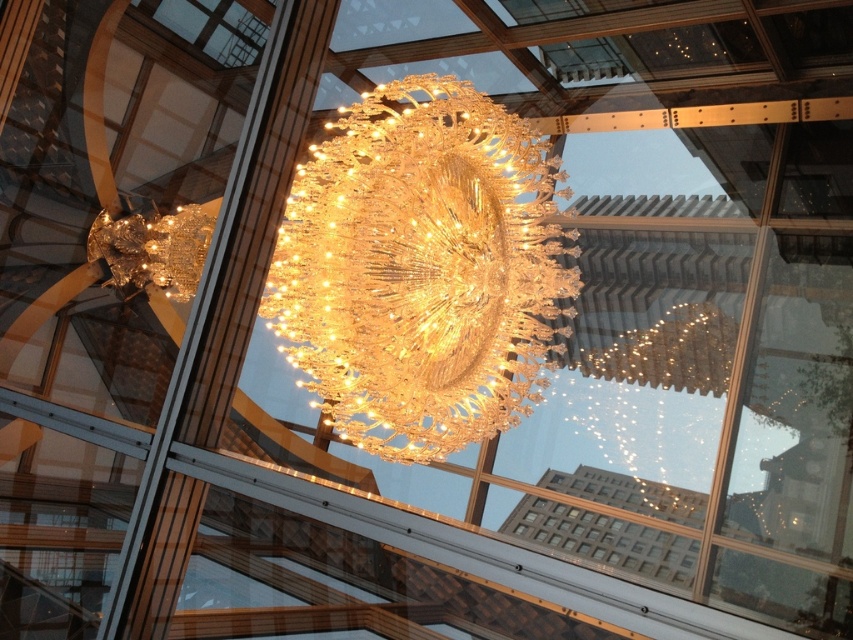
You are standing in the atrium and want to take a photo of both the crystal glass chandelier at center and the gold crystal chandelier at upper center. Which chandelier should you focus on first to ensure both are in the frame?

You should focus on the crystal glass chandelier at center first because it is closer to you, allowing you to frame both it and the gold crystal chandelier at upper center which is further away.

You are standing in the atrium and want to place a small potted plant between the two points, point 1 at point (x=440, y=193) and point 2 at point (x=132, y=243). Which point should you stand closer to ensure the plant is placed in front of the chandelier?

To place the plant in front of the chandelier, you should stand closer to point (x=440, y=193) because it is in front of point (x=132, y=243).

You are an interior designer planning to install a new ceiling fixture. You have two options from the image, the crystal glass chandelier at center and the gold crystal chandelier at upper center. Which one is taller?

The crystal glass chandelier at center is taller than the gold crystal chandelier at upper center.